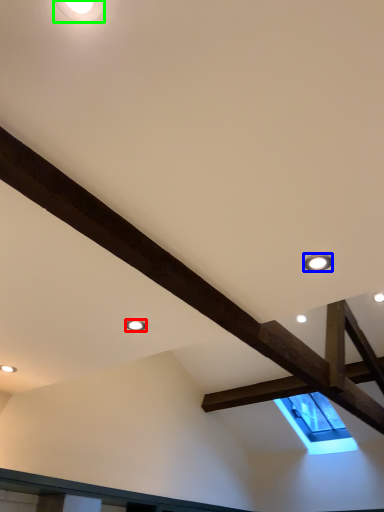
Question: Which object is positioned closest to droplight (highlighted by a red box)? Select from droplight (highlighted by a blue box) and droplight (highlighted by a green box).

Choices:
 (A) droplight
 (B) droplight

Answer: (A)